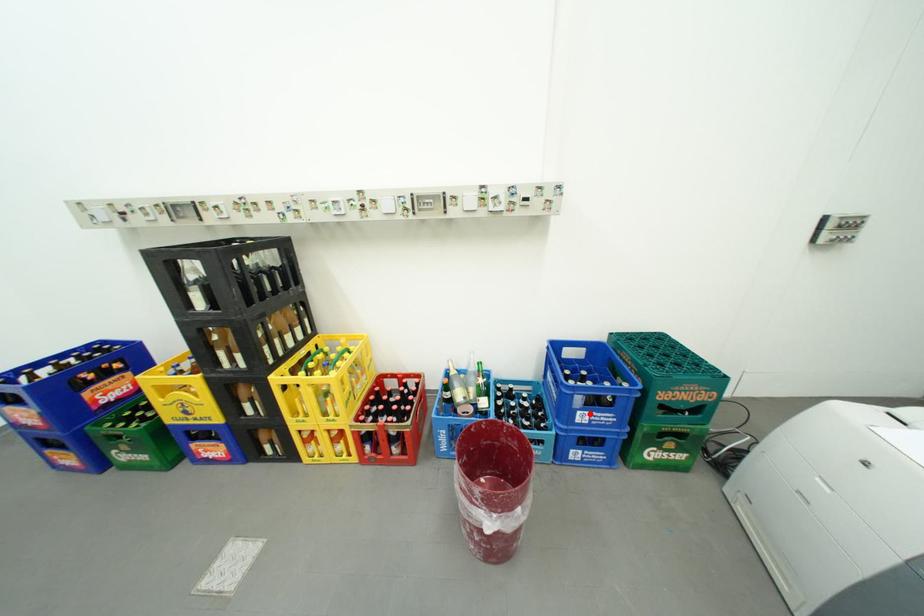
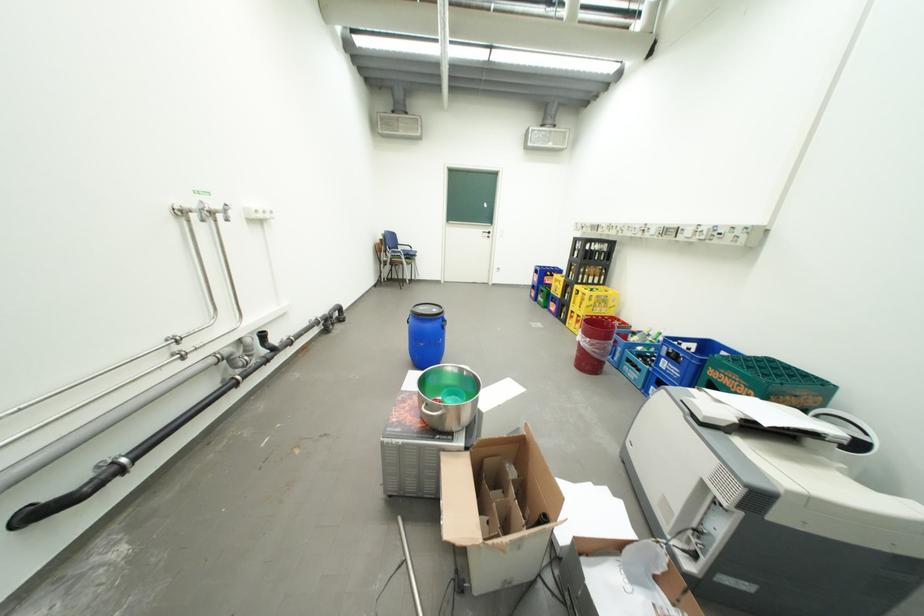
Question: I am providing you with two images of the same scene from different viewpoints. Given a red point in image1, look at the same physical point in image2. Is it:

Choices:
 (A) Closer to the viewpoint
 (B) Farther from the viewpoint

Answer: (A)